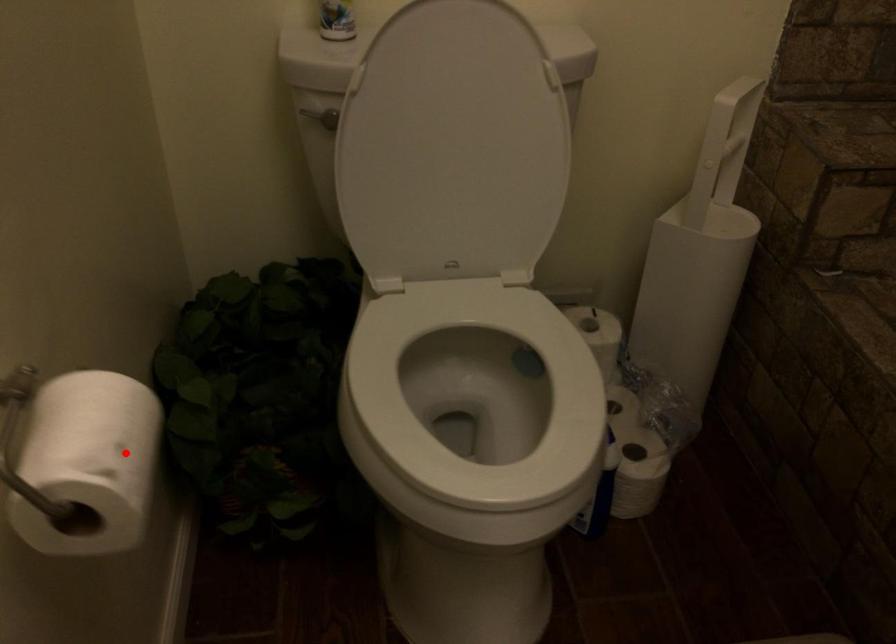
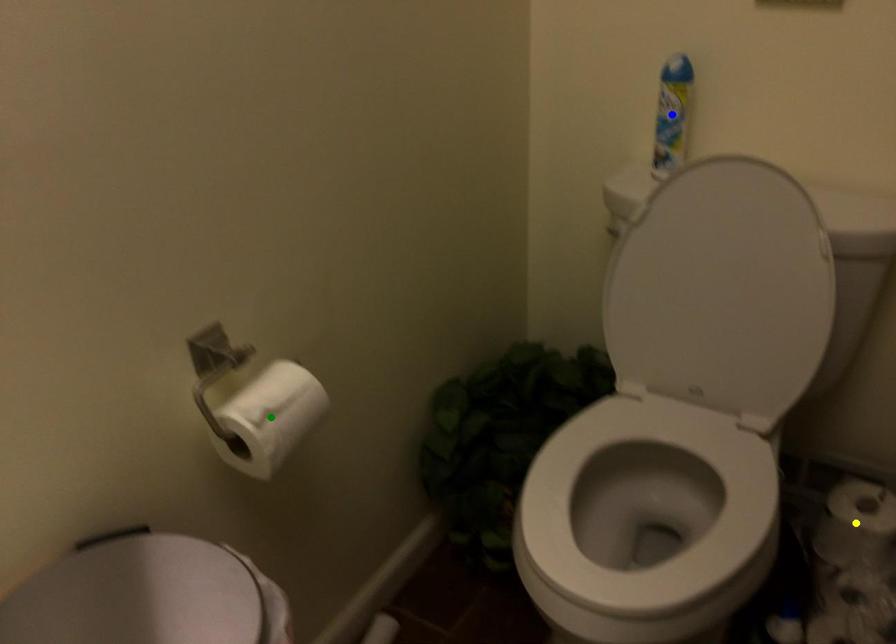
Question: I am providing you with two images of the same scene from different viewpoints. A red point is marked on the first image. You are given multiple points on the second image. Which spot in image 2 lines up with the point in image 1?

Choices:
 (A) yellow point
 (B) green point
 (C) blue point

Answer: (B)